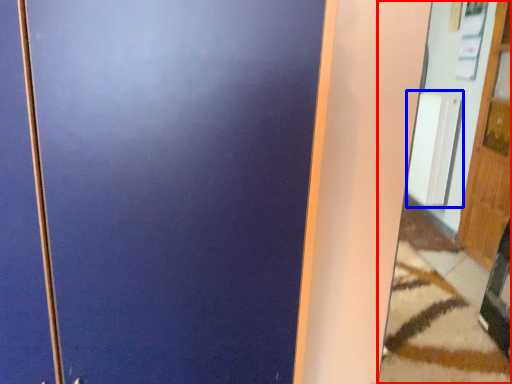
Question: Among these objects, which one is nearest to the camera, mirror (highlighted by a red box) or radiator (highlighted by a blue box)?

Choices:
 (A) mirror
 (B) radiator

Answer: (A)